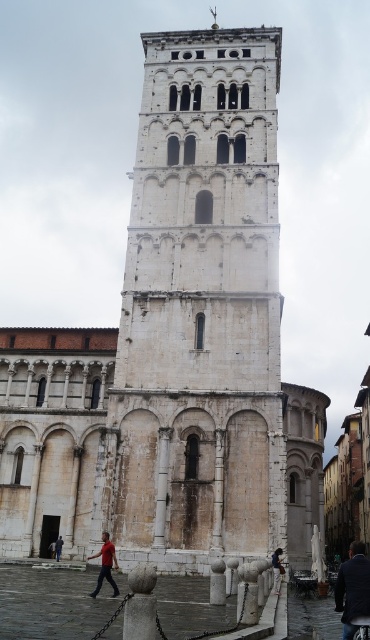
Does white stone bell tower at center appear on the right side of red cotton shirt at lower left?

Correct, you'll find white stone bell tower at center to the right of red cotton shirt at lower left.

What do you see at coordinates (200, 308) in the screenshot? I see `white stone bell tower at center` at bounding box center [200, 308].

Is point (241, 323) farther from camera compared to point (103, 561)?

Yes, point (241, 323) is farther from viewer.

Where is `white stone bell tower at center`? white stone bell tower at center is located at coordinates (200, 308).

Does white stone bell tower at center have a lesser height compared to dark blue jeans at lower right?

No, white stone bell tower at center is not shorter than dark blue jeans at lower right.

Can you confirm if white stone bell tower at center is taller than dark blue jeans at lower right?

Indeed, white stone bell tower at center has a greater height compared to dark blue jeans at lower right.

Is point (153, 426) positioned before point (274, 566)?

No, (153, 426) is further to viewer.

Identify the location of white stone bell tower at center. The width and height of the screenshot is (370, 640). (200, 308).

Can you confirm if dark blue fabric jacket at lower right is positioned to the right of red cotton shirt at lower left?

Yes, dark blue fabric jacket at lower right is to the right of red cotton shirt at lower left.

Is dark blue fabric jacket at lower right below red cotton shirt at lower left?

Correct, dark blue fabric jacket at lower right is located below red cotton shirt at lower left.

Which is in front, point (362, 564) or point (112, 563)?

Point (362, 564) is in front.

Where is `dark blue fabric jacket at lower right`? The image size is (370, 640). dark blue fabric jacket at lower right is located at coordinates tap(352, 588).